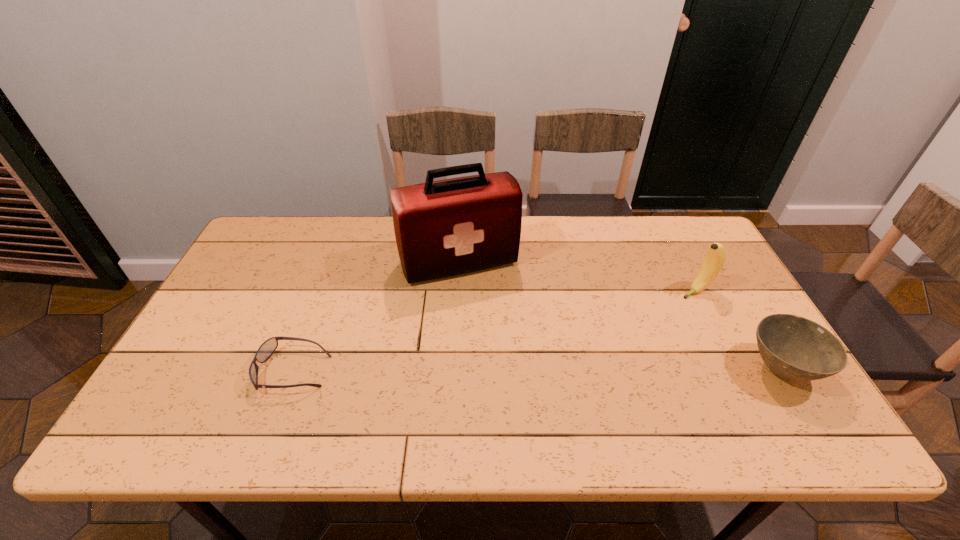
You are a GUI agent. You are given a task and a screenshot of the screen. Output one action in this format:
    pyautogui.click(x=<x>, y=<y>)
    Task: Click on the free spot between the banana and the third tallest object
    
    Given the screenshot: What is the action you would take?
    pyautogui.click(x=738, y=330)

Where is `free space between the second object from left to right and the shortest object`? free space between the second object from left to right and the shortest object is located at coordinates (376, 317).

Find the location of a particular element. free area in between the third tallest object and the leftmost object is located at coordinates (537, 370).

This screenshot has height=540, width=960. Find the location of `free space between the bowl and the leftmost object`. free space between the bowl and the leftmost object is located at coordinates pos(537,370).

The height and width of the screenshot is (540, 960). I want to click on vacant region between the shortest object and the tallest object, so click(376, 317).

Where is `vacant space that's between the bowl and the shortest object`? This screenshot has width=960, height=540. vacant space that's between the bowl and the shortest object is located at coordinates (537, 370).

Locate an element on the screen. Image resolution: width=960 pixels, height=540 pixels. empty space that is in between the leftmost object and the bowl is located at coordinates (537, 370).

This screenshot has height=540, width=960. Find the location of `object that is the third closest to the bowl`. object that is the third closest to the bowl is located at coordinates (267, 348).

The height and width of the screenshot is (540, 960). What are the coordinates of `object that is the closest one to the second shortest object` in the screenshot? It's located at (716, 256).

Identify the location of vacant point that satisfies the following two spatial constraints: 1. on the front side of the third object from right to left; 2. on the left side of the bowl. (453, 370).